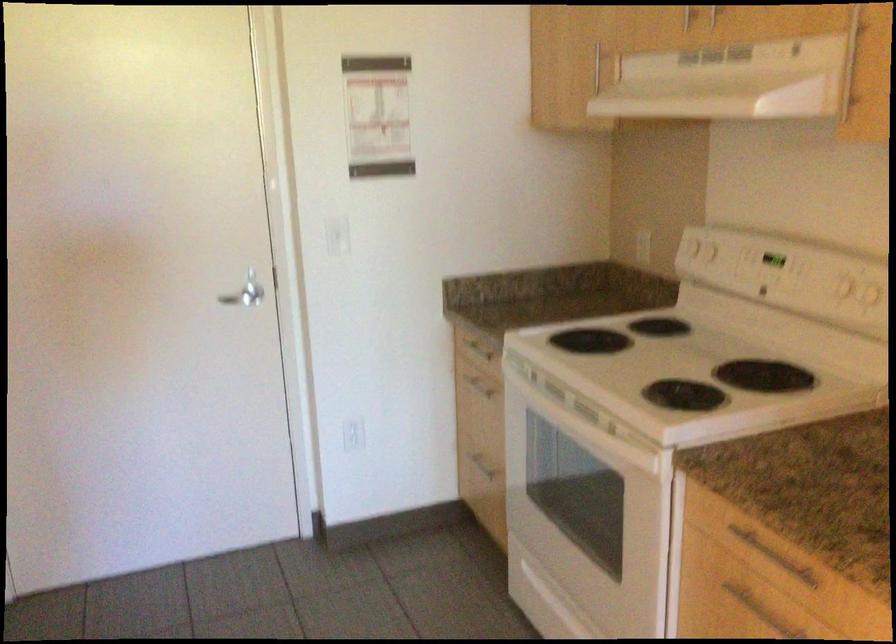
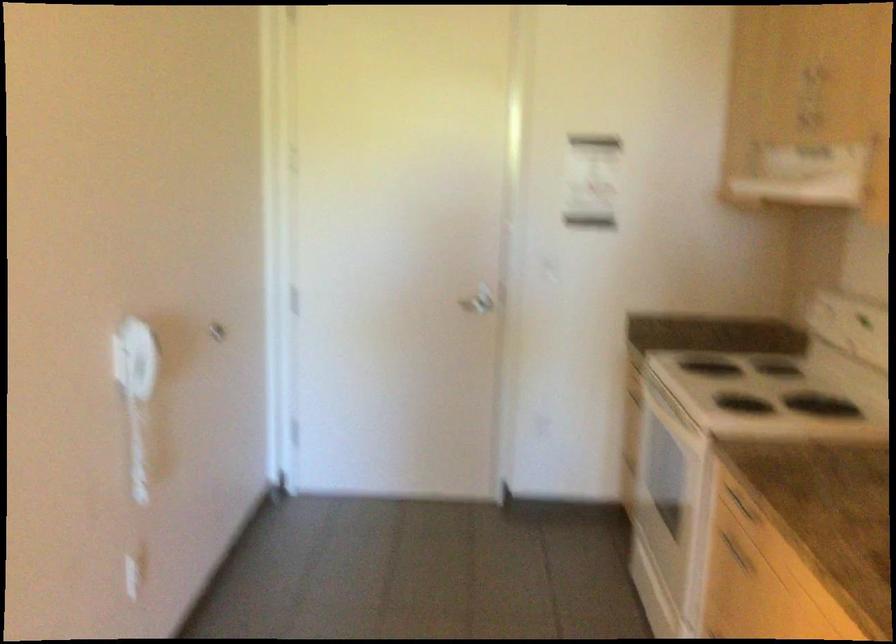
In the second image, find the point that corresponds to (247,288) in the first image.

(478, 301)